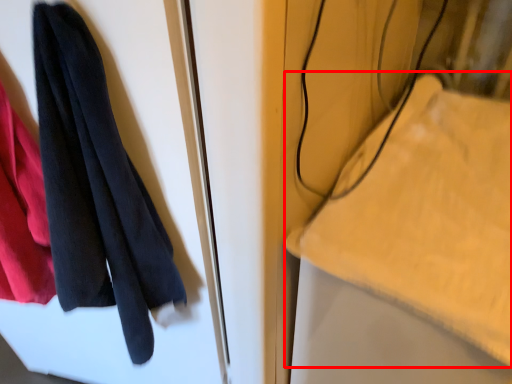
Question: From the image's perspective, what is the correct spatial positioning of cloth (annotated by the red box) in reference to towel?

Choices:
 (A) below
 (B) above

Answer: (A)